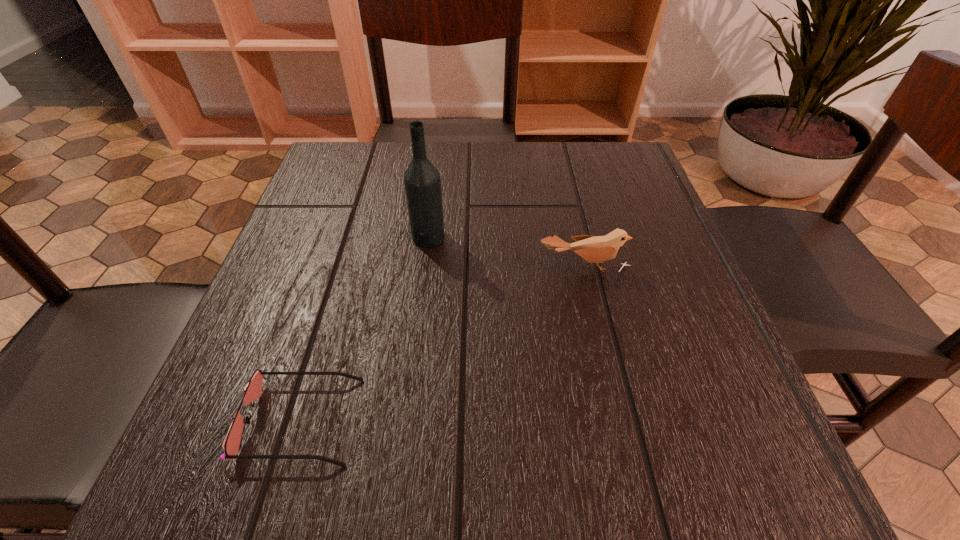
Image resolution: width=960 pixels, height=540 pixels. Identify the location of vacant space in between the rightmost object and the shortest object. (442, 343).

The width and height of the screenshot is (960, 540). What are the coordinates of `empty space that is in between the farthest object and the nearest object` in the screenshot? It's located at (365, 329).

The width and height of the screenshot is (960, 540). Find the location of `blank region between the bird and the sunglasses`. blank region between the bird and the sunglasses is located at coordinates (442, 343).

Locate an element on the screen. free spot between the rightmost object and the farthest object is located at coordinates (506, 252).

Locate an element on the screen. free area in between the second farthest object and the nearest object is located at coordinates (442, 343).

You are a GUI agent. You are given a task and a screenshot of the screen. Output one action in this format:
    pyautogui.click(x=<x>, y=<y>)
    Task: Click on the vacant space that is in between the second tallest object and the leftmost object
    The width and height of the screenshot is (960, 540).
    Given the screenshot: What is the action you would take?
    pyautogui.click(x=442, y=343)

Where is `free space between the second object from left to right and the bird`? This screenshot has width=960, height=540. free space between the second object from left to right and the bird is located at coordinates (506, 252).

Where is `vacant point located between the vodka and the bird`? The width and height of the screenshot is (960, 540). vacant point located between the vodka and the bird is located at coordinates point(506,252).

In order to click on free space between the second object from left to right and the rightmost object in this screenshot , I will do `click(506, 252)`.

Identify which object is located as the nearest to the vodka. Please provide its 2D coordinates. Your answer should be formatted as a tuple, i.e. [(x, y)], where the tuple contains the x and y coordinates of a point satisfying the conditions above.

[(594, 249)]